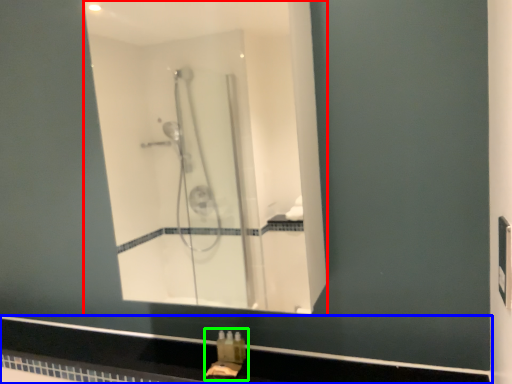
Question: Based on their relative distances, which object is nearer to mirror (highlighted by a red box)? Choose from counter top (highlighted by a blue box) and sink (highlighted by a green box).

Choices:
 (A) counter top
 (B) sink

Answer: (A)